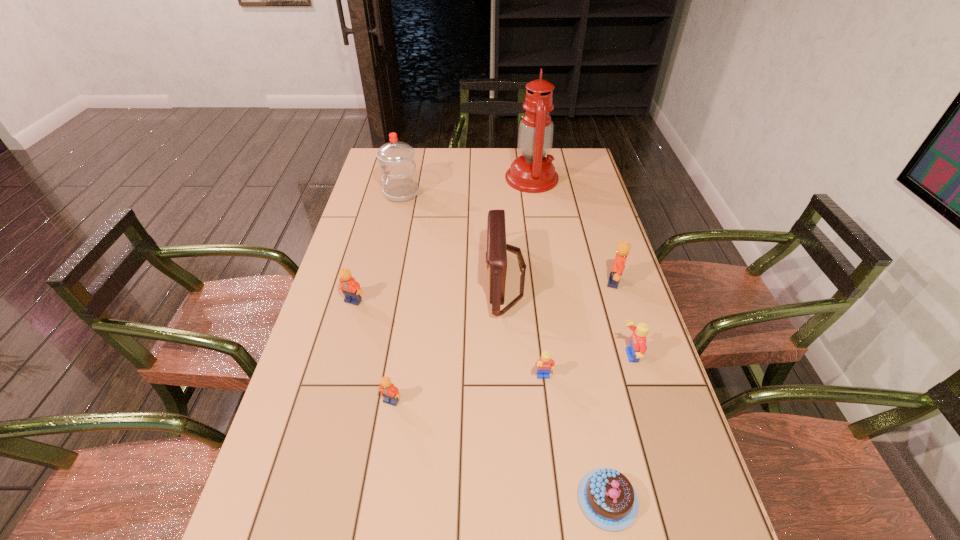
Where is `free space located 0.260m on the front flap of the shoulder bag`? This screenshot has height=540, width=960. free space located 0.260m on the front flap of the shoulder bag is located at coordinates (398, 277).

Locate an element on the screen. The image size is (960, 540). vacant space located on the front flap of the shoulder bag is located at coordinates (419, 277).

Locate an element on the screen. The width and height of the screenshot is (960, 540). vacant space located on the front-facing side of the farthest Lego is located at coordinates (507, 282).

Locate an element on the screen. vacant space situated 0.390m on the front-facing side of the farthest Lego is located at coordinates (473, 282).

The height and width of the screenshot is (540, 960). I want to click on free space located on the front-facing side of the farthest Lego, so click(480, 282).

Find the location of a particular element. free spot located 0.390m on the front-facing side of the second smallest orange Lego is located at coordinates (314, 440).

Identify the location of free region located on the face of the bigger yellow Lego. This screenshot has height=540, width=960. (460, 356).

You are a GUI agent. You are given a task and a screenshot of the screen. Output one action in this format:
    pyautogui.click(x=<x>, y=<y>)
    Task: Click on the vacant space situated on the face of the bigger yellow Lego
    The width and height of the screenshot is (960, 540).
    Given the screenshot: What is the action you would take?
    pyautogui.click(x=471, y=356)

You are a GUI agent. You are given a task and a screenshot of the screen. Output one action in this format:
    pyautogui.click(x=<x>, y=<y>)
    Task: Click on the vacant space positioned on the face of the bigger yellow Lego
    This screenshot has height=540, width=960.
    Given the screenshot: What is the action you would take?
    pyautogui.click(x=563, y=356)

You are a GUI agent. You are given a task and a screenshot of the screen. Output one action in this format:
    pyautogui.click(x=<x>, y=<y>)
    Task: Click on the free space located on the front-facing side of the nearest Lego
    This screenshot has height=540, width=960.
    Given the screenshot: What is the action you would take?
    pyautogui.click(x=384, y=444)